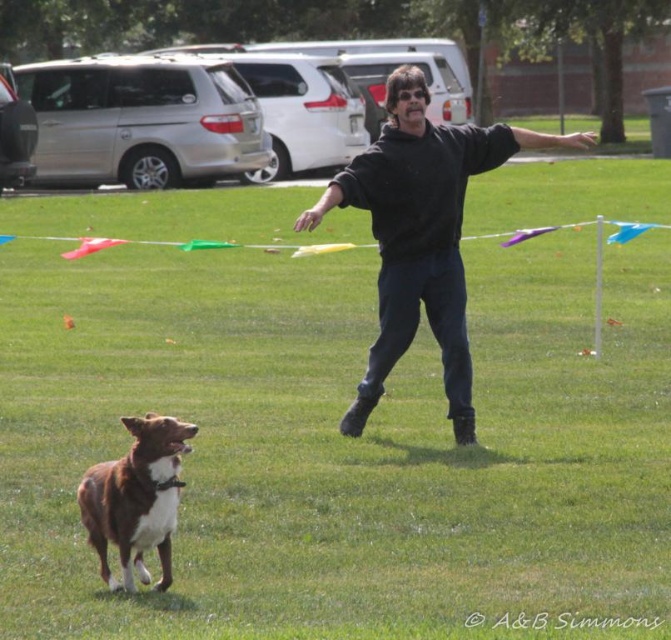
Question: Does black sweatshirt at center have a greater width compared to multicolored fabric kite at center?

Choices:
 (A) no
 (B) yes

Answer: (A)

Question: Based on their relative distances, which object is farther from the black sweatshirt at center?

Choices:
 (A) multicolored fabric kite at center
 (B) brown furry dog at lower left

Answer: (A)

Question: Does black sweatshirt at center appear over brown furry dog at lower left?

Choices:
 (A) no
 (B) yes

Answer: (B)

Question: Considering the relative positions of black sweatshirt at center and multicolored fabric kite at center in the image provided, where is black sweatshirt at center located with respect to multicolored fabric kite at center?

Choices:
 (A) right
 (B) left

Answer: (A)

Question: Which object appears closest to the camera in this image?

Choices:
 (A) black sweatshirt at center
 (B) multicolored fabric kite at center

Answer: (A)

Question: Among these points, which one is farthest from the camera?

Choices:
 (A) (197, 243)
 (B) (158, 436)
 (C) (450, 240)

Answer: (A)